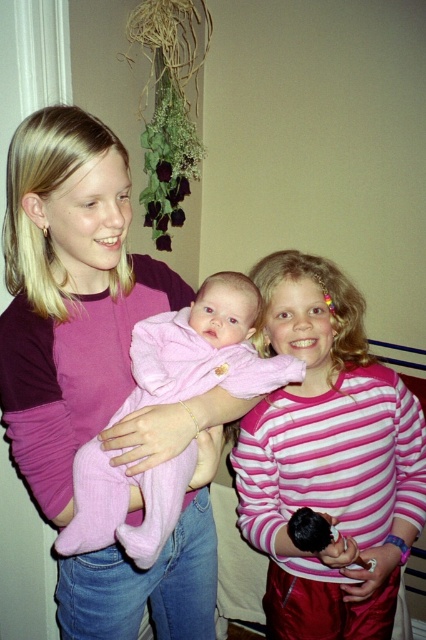
Is pink fabric baby at left positioned at the back of pink soft fabric baby at center?

Yes.

Is point (115, 157) farther from viewer compared to point (175, 467)?

No.

Locate an element on the screen. This screenshot has height=640, width=426. pink fabric baby at left is located at coordinates (77, 307).

Between pink striped shirt at center and pink soft fabric baby at center, which one is positioned lower?

pink striped shirt at center

Can you confirm if pink striped shirt at center is smaller than pink soft fabric baby at center?

No.

Find the location of `pink striped shirt at center`. pink striped shirt at center is located at coordinates (328, 460).

What are the coordinates of `pink striped shirt at center` in the screenshot? It's located at pos(328,460).

Does pink fabric baby at left appear under pink striped shirt at center?

Incorrect, pink fabric baby at left is not positioned below pink striped shirt at center.

Does point (63, 272) lie behind point (417, 506)?

No.

This screenshot has height=640, width=426. What do you see at coordinates (77, 307) in the screenshot? I see `pink fabric baby at left` at bounding box center [77, 307].

Locate an element on the screen. This screenshot has width=426, height=640. pink fabric baby at left is located at coordinates (77, 307).